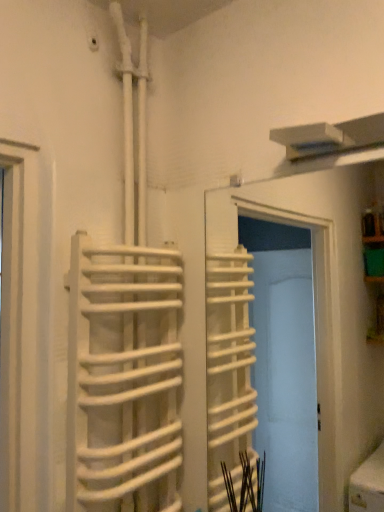
This screenshot has width=384, height=512. I want to click on black matte wire at lower center, so click(246, 484).

Image resolution: width=384 pixels, height=512 pixels. What do you see at coordinates (246, 484) in the screenshot?
I see `black matte wire at lower center` at bounding box center [246, 484].

This screenshot has width=384, height=512. In order to click on black matte wire at lower center in this screenshot , I will do `click(246, 484)`.